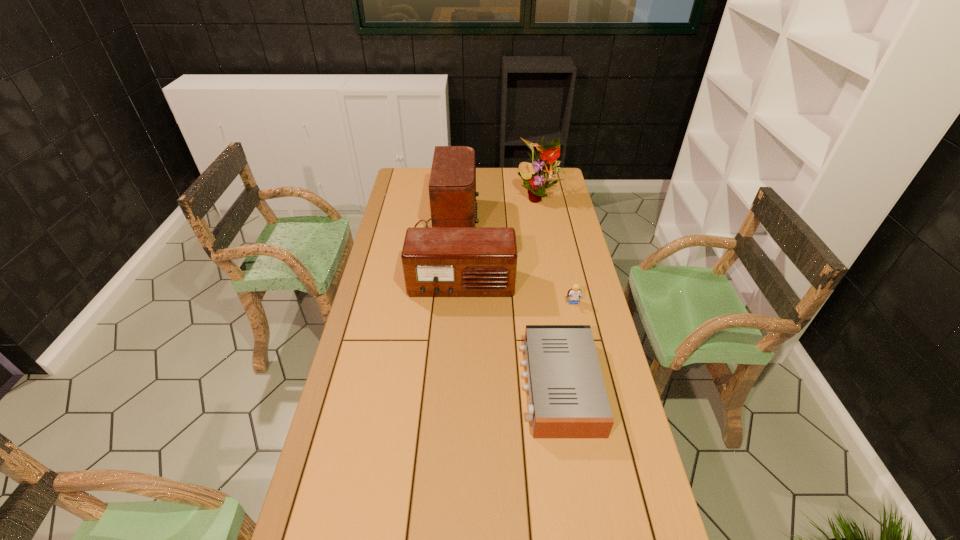
You are a GUI agent. You are given a task and a screenshot of the screen. Output one action in this format:
    pyautogui.click(x=<x>, y=<y>)
    Task: Click on the vacant area in the image that satisfies the following two spatial constraints: 1. on the front-facing side of the Lego; 2. on the control panel of the nearest object
    Image resolution: width=960 pixels, height=540 pixels.
    Given the screenshot: What is the action you would take?
    pyautogui.click(x=591, y=386)

Identify the location of free point that satisfies the following two spatial constraints: 1. on the front-facing side of the bouquet; 2. on the front panel of the farthest radio receiver. (542, 219).

Where is `blank area in the image that satisfies the following two spatial constraints: 1. on the front-facing side of the bouquet; 2. on the control panel of the nearest radio receiver`? This screenshot has width=960, height=540. blank area in the image that satisfies the following two spatial constraints: 1. on the front-facing side of the bouquet; 2. on the control panel of the nearest radio receiver is located at coordinates (573, 386).